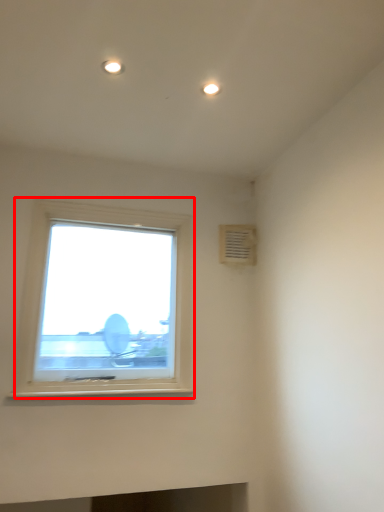
Question: From the image, what is the correct spatial relationship of window (annotated by the red box) in relation to air conditioning?

Choices:
 (A) right
 (B) left

Answer: (B)